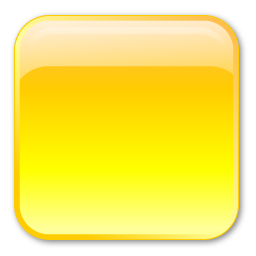
Find the location of a particular element. This screenshot has height=256, width=256. light  yellow trim is located at coordinates (17, 52).